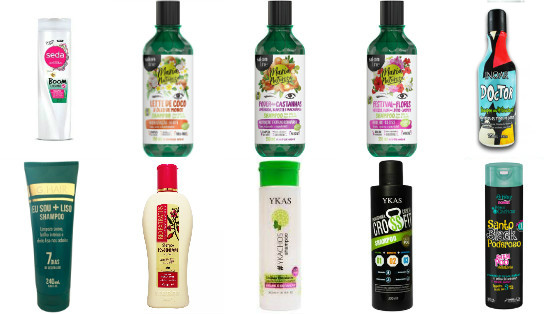
Image resolution: width=560 pixels, height=314 pixels. I want to click on bottle, so pyautogui.click(x=55, y=89), pyautogui.click(x=158, y=105), pyautogui.click(x=272, y=102), pyautogui.click(x=390, y=97), pyautogui.click(x=493, y=103), pyautogui.click(x=66, y=237), pyautogui.click(x=171, y=240), pyautogui.click(x=277, y=231), pyautogui.click(x=392, y=235), pyautogui.click(x=513, y=230).